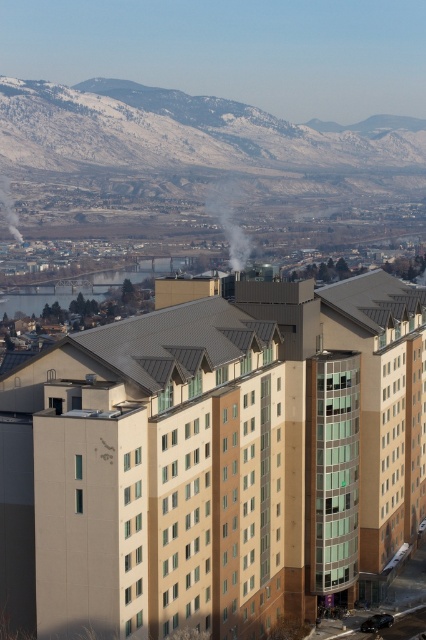
You are a fire safety inspector examining the building. You notice two smoke sources in the image. Which one is the larger one between the white smoke at center and the smokesmoky at left?

The white smoke at center is larger in size than the smokesmoky at left.

You are standing in front of the modern residential building and want to determine the relative positions of two points marked on the building facade. The points are labeled as point 1 at coordinates point (241, 195) and point 2 at coordinates point (8, 211). Which point is closer to you when observing the building from the front?

Point 1 at coordinates point (241, 195) is closer to you because it is further to the viewer than point 2 at coordinates point (8, 211).